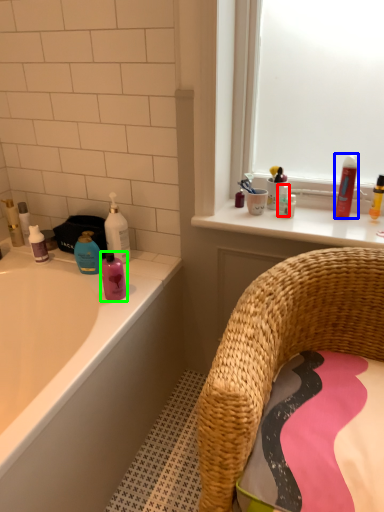
Question: Based on their relative distances, which object is nearer to toiletry (highlighted by a red box)? Choose from mouthwash (highlighted by a blue box) and mouthwash (highlighted by a green box).

Choices:
 (A) mouthwash
 (B) mouthwash

Answer: (A)